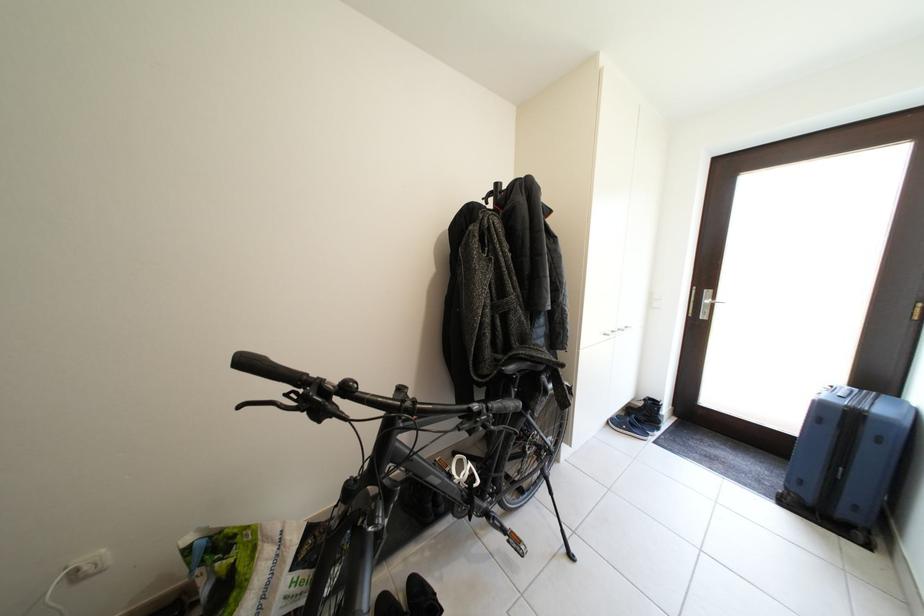
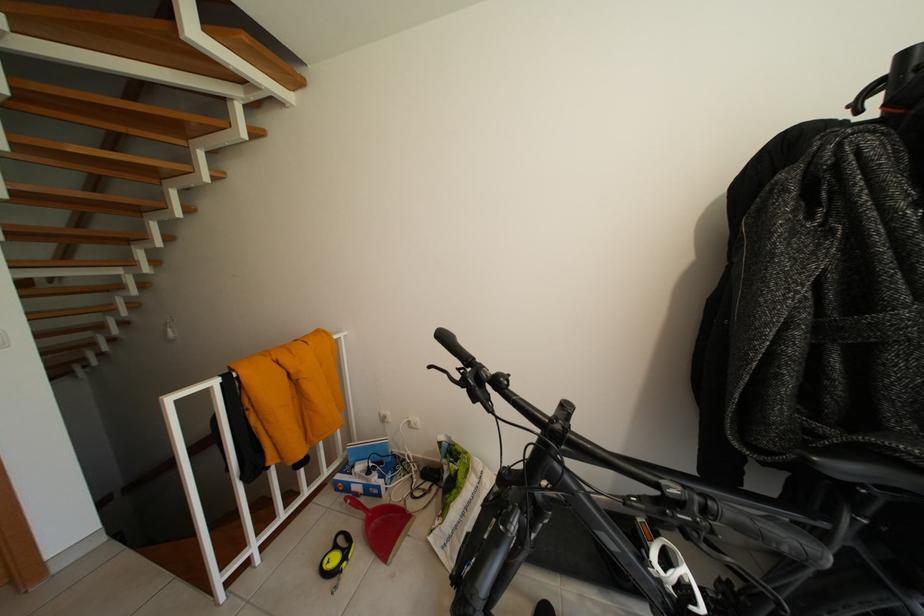
In the second image, find the point that corresponds to (488,418) in the first image.

(688, 509)